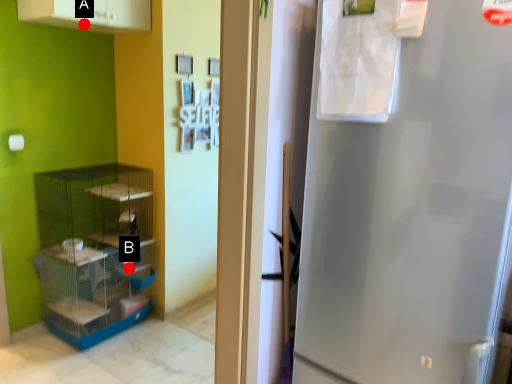
Question: Two points are circled on the image, labeled by A and B beside each circle. Which of the following is the closest to the observer?

Choices:
 (A) A is closer
 (B) B is closer

Answer: (A)